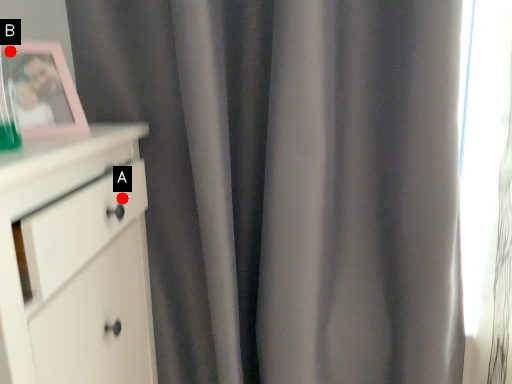
Question: Two points are circled on the image, labeled by A and B beside each circle. Which point is farther to the camera?

Choices:
 (A) A is further
 (B) B is further

Answer: (A)